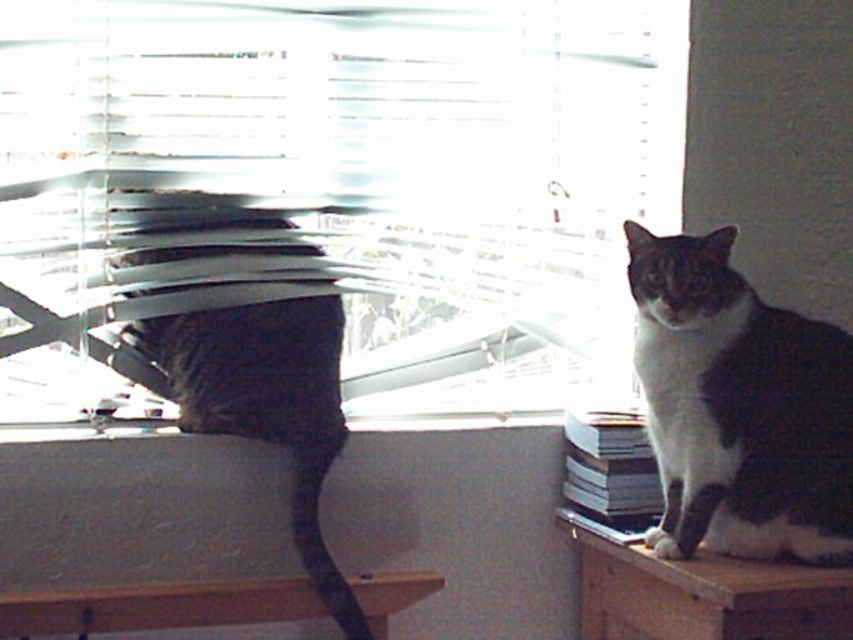
Question: Which of these objects is positioned farthest from the black and white fur cat at right?

Choices:
 (A) wooden table at right
 (B) white plastic blinds at upper center
 (C) wooden table at lower left
 (D) dark gray fur cat at left

Answer: (D)

Question: Is the position of wooden table at right more distant than that of wooden table at lower left?

Choices:
 (A) yes
 (B) no

Answer: (B)

Question: Can you confirm if white plastic blinds at upper center is positioned to the left of wooden table at right?

Choices:
 (A) yes
 (B) no

Answer: (A)

Question: Which is farther from the black and white fur cat at right?

Choices:
 (A) wooden table at lower left
 (B) white plastic blinds at upper center

Answer: (A)

Question: Among these objects, which one is nearest to the camera?

Choices:
 (A) wooden table at right
 (B) black and white fur cat at right

Answer: (A)

Question: Can you confirm if white plastic blinds at upper center is smaller than wooden table at right?

Choices:
 (A) yes
 (B) no

Answer: (B)